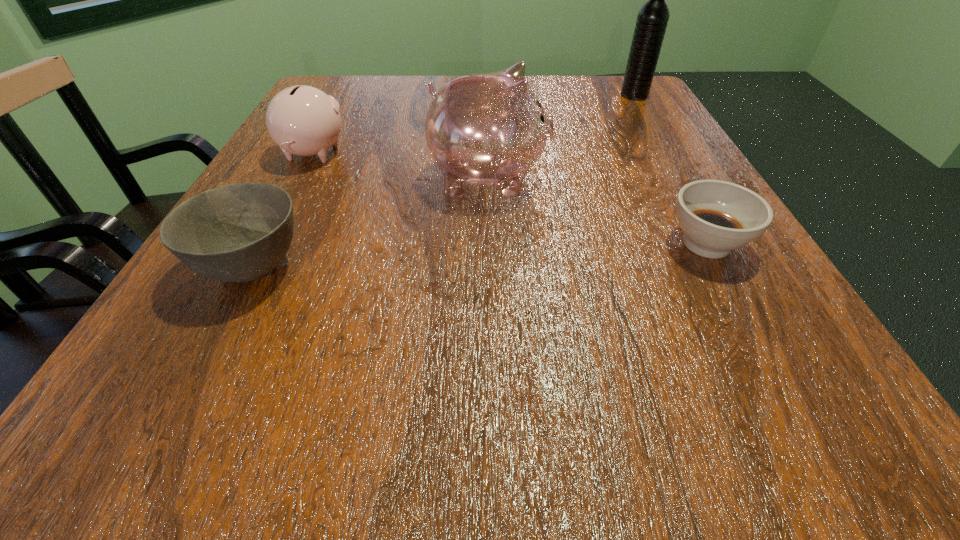
This screenshot has height=540, width=960. In the image, there is a desktop. In order to click on free space at the left edge in this screenshot , I will do `click(231, 298)`.

The image size is (960, 540). In order to click on vacant space at the right edge of the desktop in this screenshot , I will do `click(764, 307)`.

In the image, there is a desktop. Where is `free space at the far right corner`? The image size is (960, 540). free space at the far right corner is located at coordinates (612, 113).

You are a GUI agent. You are given a task and a screenshot of the screen. Output one action in this format:
    pyautogui.click(x=<x>, y=<y>)
    Task: Click on the blank space at the near right corner of the desktop
    The width and height of the screenshot is (960, 540).
    Given the screenshot: What is the action you would take?
    coord(879,436)

Find the location of a particular element. This screenshot has width=960, height=540. vacant region between the fourth tallest object and the shortest object is located at coordinates (480, 255).

I want to click on unoccupied position between the shortest object and the left piggy bank, so click(x=510, y=199).

You are a GUI agent. You are given a task and a screenshot of the screen. Output one action in this format:
    pyautogui.click(x=<x>, y=<y>)
    Task: Click on the free space between the soup bowl and the second shortest object
    The image size is (960, 540).
    Given the screenshot: What is the action you would take?
    pyautogui.click(x=480, y=255)

Identify the location of vacant area between the soup bowl and the shorter piggy bank. (510, 199).

Where is `vacant space that is in between the third object from left to right and the bowl`? The image size is (960, 540). vacant space that is in between the third object from left to right and the bowl is located at coordinates (371, 222).

Image resolution: width=960 pixels, height=540 pixels. In order to click on vacant space in between the shortest object and the shorter piggy bank in this screenshot , I will do `click(510, 199)`.